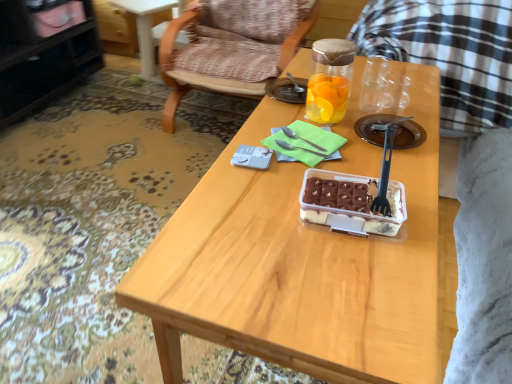
You are a GUI agent. You are given a task and a screenshot of the screen. Output one action in this format:
    pyautogui.click(x=<x>, y=<y>)
    Task: Click on the free location to the right of satin silver fork at center, the second fork in the front-to-back sequence
    The width and height of the screenshot is (512, 384).
    Given the screenshot: What is the action you would take?
    pyautogui.click(x=365, y=151)